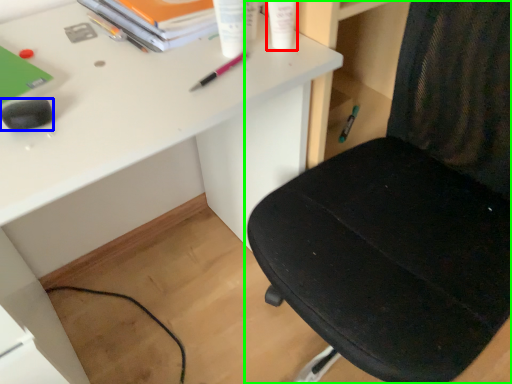
Question: Considering the real-world distances, which object is farthest from stationery (highlighted by a red box)? stationery (highlighted by a blue box) or chair (highlighted by a green box)?

Choices:
 (A) stationery
 (B) chair

Answer: (A)